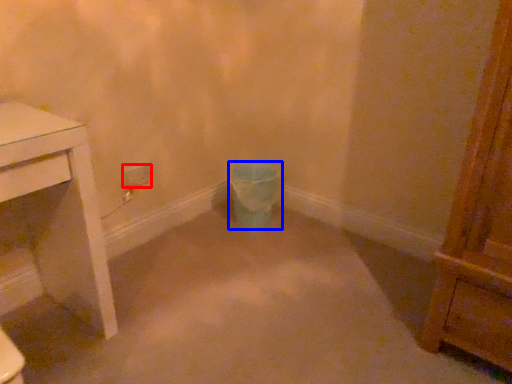
Question: Which object appears closest to the camera in this image, power plugs and sockets (highlighted by a red box) or toilet bowl (highlighted by a blue box)?

Choices:
 (A) power plugs and sockets
 (B) toilet bowl

Answer: (A)